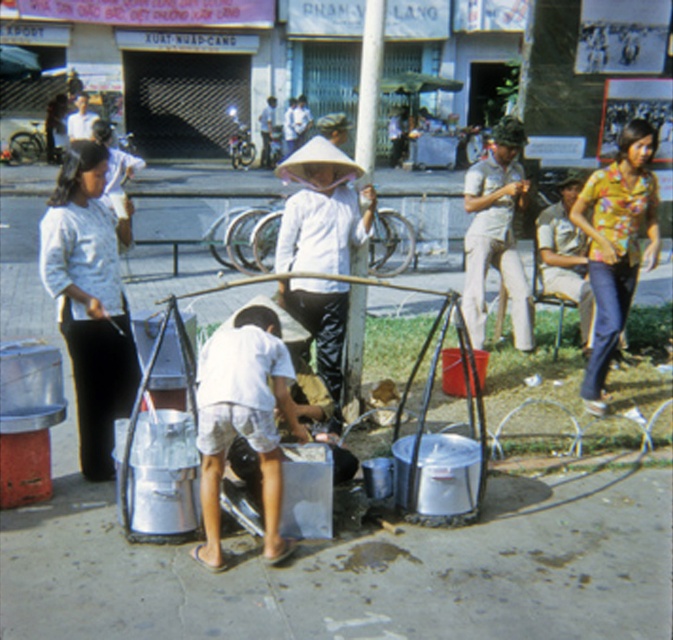
You are a customer waiting in line at the food stall. You notice two people working there wearing different shirts. The person in the white cotton shirt at left is shorter than the floral yellow shirt at right. Which shirt is worn by the taller worker?

The floral yellow shirt at right is taller because the white cotton shirt at left is not as tall as it.

You are a tourist walking along the street and want to approach both the white cotton shirt at left and the floral yellow shirt at right. Which person should you approach first based on their position?

You should approach the white cotton shirt at left first because it is closer to you than the floral yellow shirt at right.